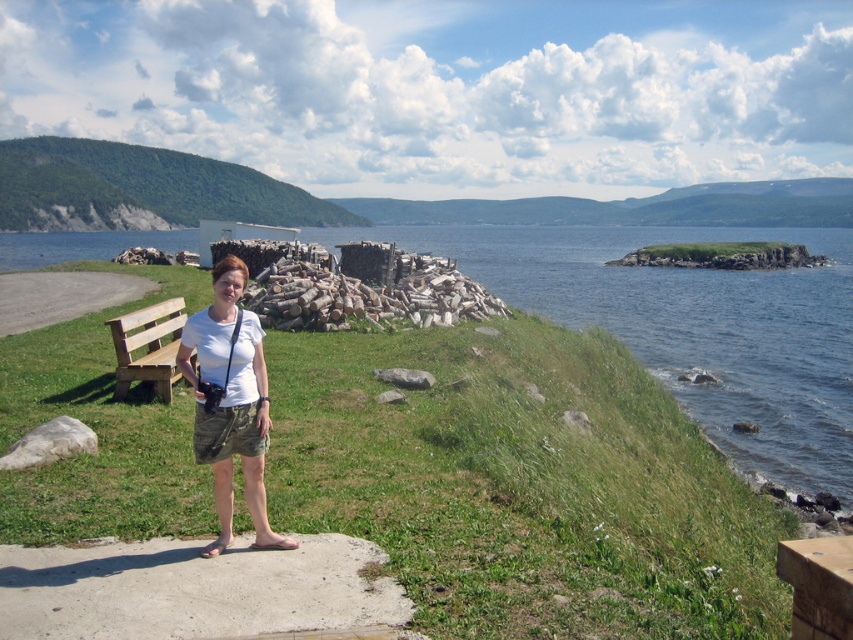
You are standing at the edge of the water and want to place a small picnic basket between the green grassy at center and the white cotton shirt at center. Which object should you place it closer to so that it doesn not get wet?

The green grassy at center is wider than the white cotton shirt at center, so placing the picnic basket closer to the white cotton shirt at center would keep it further from the water edge and less likely to get wet.

You are a photographer trying to capture a photo of the wooden bench at left. You are currently standing at the white cotton shirt at center. How should you adjust your position to focus on the bench?

Since the white cotton shirt at center is closer to the viewer than the wooden bench at left, you should move backward to focus on the wooden bench at left.